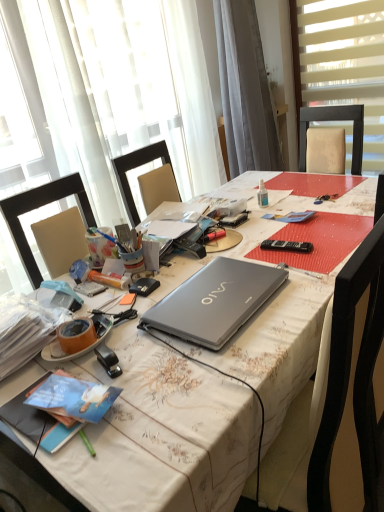
The width and height of the screenshot is (384, 512). I want to click on vacant region above silver metallic laptop at center (from a real-world perspective), so click(217, 290).